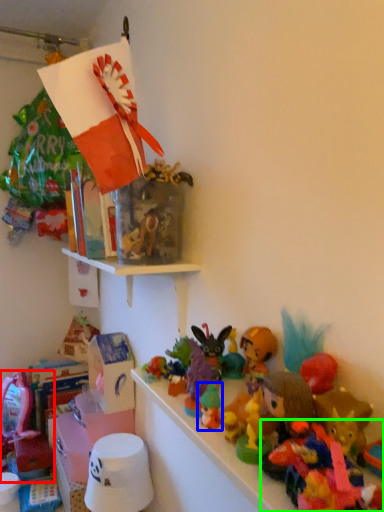
Question: Estimate the real-world distances between objects in this image. Which object is closer to toy (highlighted by a red box), toy (highlighted by a blue box) or toy (highlighted by a green box)?

Choices:
 (A) toy
 (B) toy

Answer: (A)